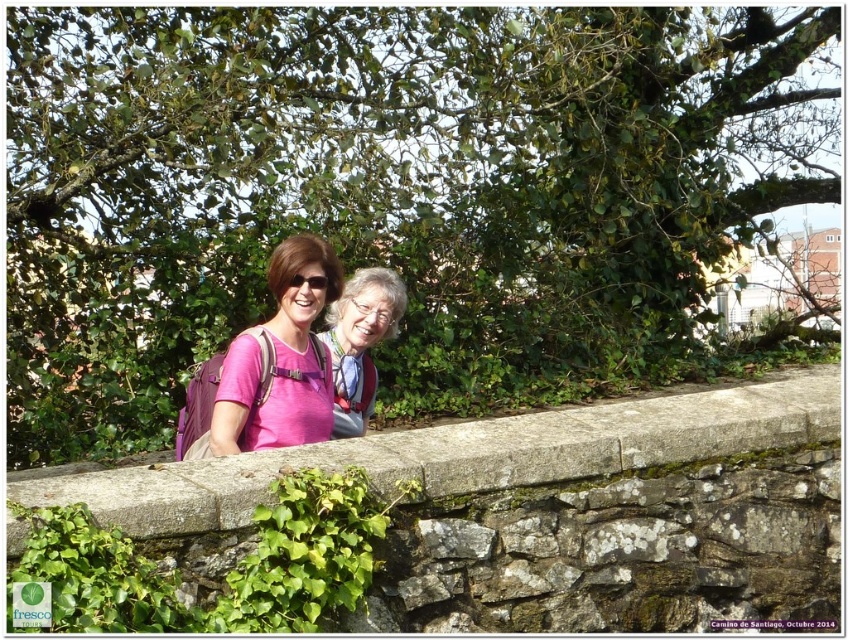
Looking at this image, you are a photographer trying to capture a photo of the green leafy tree at upper center and the pink fabric shirt at center. Which object is taller in the image?

The green leafy tree at upper center is much taller than the pink fabric shirt at center.

You are taking a photo of the two individuals behind the stone wall. To ensure the green leafy tree at upper center doesn not block the subjects, where should you position the camera relative to the tree?

The green leafy tree at upper center is located at point (383, 189), so you should position the camera to the right or left of the tree to avoid blocking the subjects.

You are a photographer trying to capture a photo of the two people behind the stone wall. You want to include both the green leafy tree at upper center and the gray stone ledge at center in the frame. Which object will take up more space in the photo?

The green leafy tree at upper center will take up more space in the photo because it is larger in size than the gray stone ledge at center.